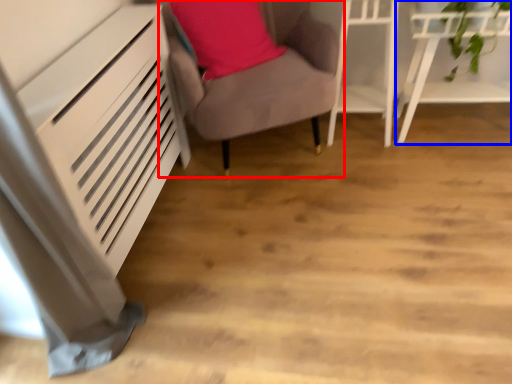
Question: Which of the following is the farthest to the observer, furniture (highlighted by a red box) or furniture (highlighted by a blue box)?

Choices:
 (A) furniture
 (B) furniture

Answer: (B)